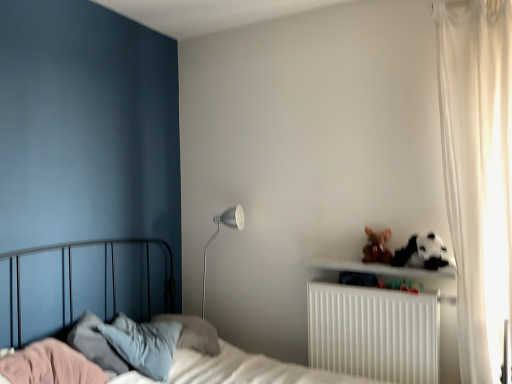
Question: Is point (504, 309) positioned closer to the camera than point (371, 382)?

Choices:
 (A) farther
 (B) closer

Answer: (B)

Question: From a real-world perspective, is white sheer curtain at right physically located above or below metallic bed at left?

Choices:
 (A) below
 (B) above

Answer: (B)

Question: Considering the real-world distances, which object is farthest from the white sheer curtain at right?

Choices:
 (A) metallic bed at left
 (B) white plastic radiator at lower right
 (C) brown plush toy at upper right
 (D) silver metallic floor lamp at center-left

Answer: (D)

Question: Which object is positioned closest to the white plastic radiator at lower right?

Choices:
 (A) brown plush toy at upper right
 (B) white sheer curtain at right
 (C) metallic bed at left
 (D) silver metallic floor lamp at center-left

Answer: (A)